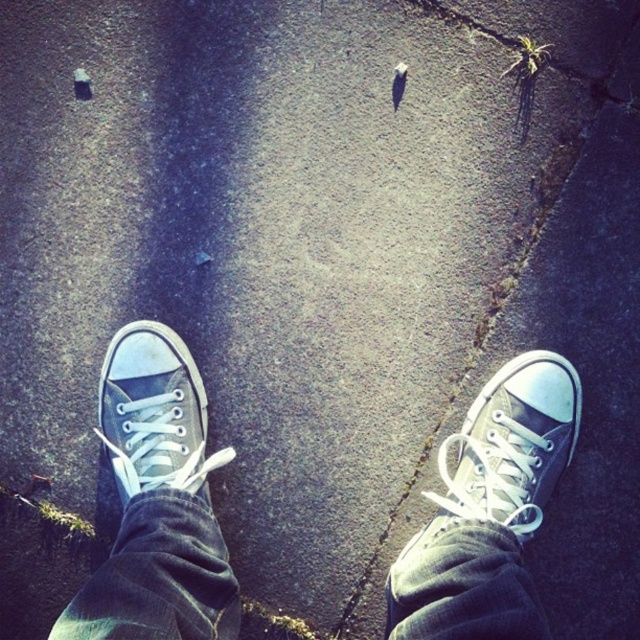
Question: Can you confirm if white canvas sneakers at center is smaller than green canvas shoe at center?

Choices:
 (A) no
 (B) yes

Answer: (B)

Question: Which object appears farthest from the camera in this image?

Choices:
 (A) white canvas sneakers at center
 (B) green canvas shoe at center

Answer: (A)

Question: Is the position of white canvas sneakers at center more distant than that of gray canvas shoe at center?

Choices:
 (A) yes
 (B) no

Answer: (B)

Question: Is white canvas sneakers at center above green canvas shoe at center?

Choices:
 (A) yes
 (B) no

Answer: (A)

Question: Among these objects, which one is farthest from the camera?

Choices:
 (A) gray canvas shoe at center
 (B) green canvas shoe at center
 (C) white canvas sneakers at center

Answer: (A)

Question: Which object appears farthest from the camera in this image?

Choices:
 (A) green canvas shoe at center
 (B) white canvas sneakers at center

Answer: (B)